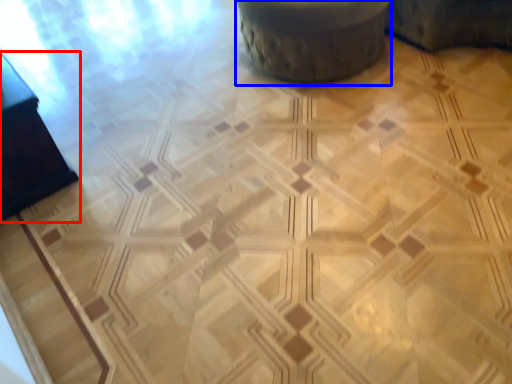
Question: Which point is closer to the camera, furniture (highlighted by a red box) or swivel chair (highlighted by a blue box)?

Choices:
 (A) furniture
 (B) swivel chair

Answer: (A)